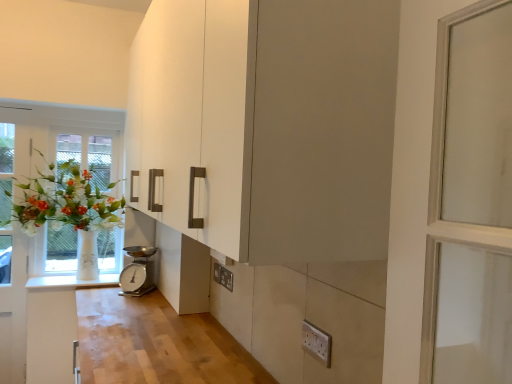
Question: Is white plastic electric outlet at lower center, the 2th electric outlet viewed from the front, located outside white glass vase at left?

Choices:
 (A) yes
 (B) no

Answer: (A)

Question: Can you confirm if white plastic electric outlet at lower center, the 2th electric outlet viewed from the front, is thinner than white glass vase at left?

Choices:
 (A) yes
 (B) no

Answer: (A)

Question: Considering the relative positions of white plastic electric outlet at lower center, the 2th electric outlet viewed from the front, and white glass vase at left in the image provided, is white plastic electric outlet at lower center, the 2th electric outlet viewed from the front, in front of white glass vase at left?

Choices:
 (A) no
 (B) yes

Answer: (B)

Question: From the image's perspective, does white plastic electric outlet at lower center, the 2th electric outlet viewed from the front, appear higher than white glass vase at left?

Choices:
 (A) no
 (B) yes

Answer: (A)

Question: From a real-world perspective, is white plastic electric outlet at lower center, the first electric outlet when ordered from back to front, located higher than white glass vase at left?

Choices:
 (A) yes
 (B) no

Answer: (B)

Question: Does white plastic electric outlet at lower center, which is the second electric outlet from right to left, have a greater height compared to white glass vase at left?

Choices:
 (A) no
 (B) yes

Answer: (A)

Question: Could you tell me if silver metallic scale at lower center is facing white glass vase at left?

Choices:
 (A) no
 (B) yes

Answer: (A)

Question: Is silver metallic scale at lower center behind white glass vase at left?

Choices:
 (A) no
 (B) yes

Answer: (B)

Question: Does silver metallic scale at lower center appear on the right side of white glass vase at left?

Choices:
 (A) no
 (B) yes

Answer: (B)

Question: Would you say silver metallic scale at lower center is a long distance from white glass vase at left?

Choices:
 (A) yes
 (B) no

Answer: (B)

Question: Is silver metallic scale at lower center next to white glass vase at left?

Choices:
 (A) no
 (B) yes

Answer: (A)

Question: Is silver metallic scale at lower center positioned with its back to white glass vase at left?

Choices:
 (A) yes
 (B) no

Answer: (B)

Question: Is white plastic electric outlet at lower right, which is the second electric outlet in left-to-right order, directly adjacent to silver metallic scale at lower center?

Choices:
 (A) yes
 (B) no

Answer: (B)